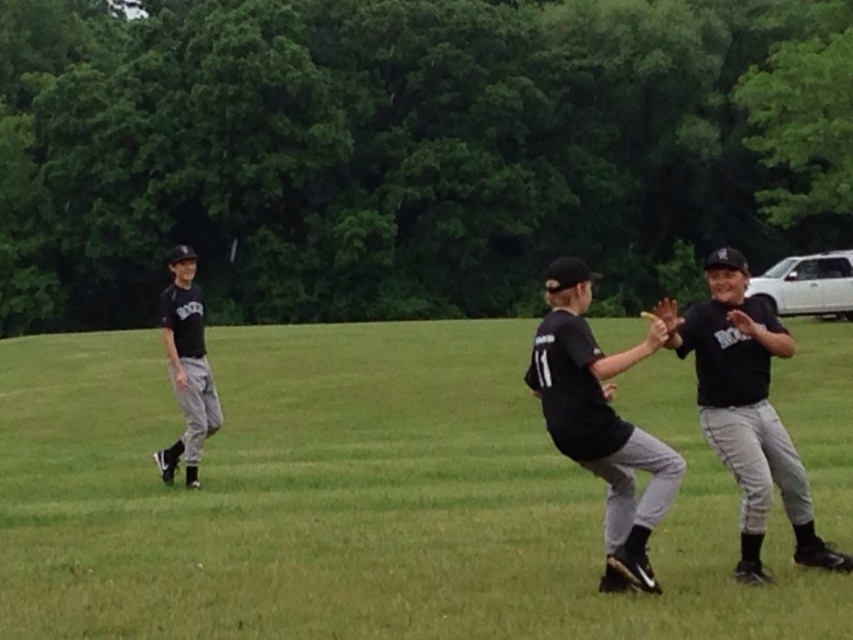
Question: Which of the following is the farthest from the observer?

Choices:
 (A) black matte baseball cap at upper right
 (B) black matte uniform at left
 (C) black matte baseball glove at center
 (D) green grass at center

Answer: (B)

Question: Is green grass at center below black matte baseball cap at upper right?

Choices:
 (A) yes
 (B) no

Answer: (A)

Question: Does black matte baseball glove at center lie behind black matte uniform at left?

Choices:
 (A) no
 (B) yes

Answer: (A)

Question: Does black matte baseball cap at upper right appear under black matte baseball glove at center?

Choices:
 (A) yes
 (B) no

Answer: (B)

Question: Which object appears closest to the camera in this image?

Choices:
 (A) black matte baseball glove at center
 (B) black matte uniform at left
 (C) green grass at center
 (D) black matte baseball cap at upper right

Answer: (C)

Question: Estimate the real-world distances between objects in this image. Which object is farther from the black matte baseball glove at center?

Choices:
 (A) green grass at center
 (B) black matte uniform at left

Answer: (B)